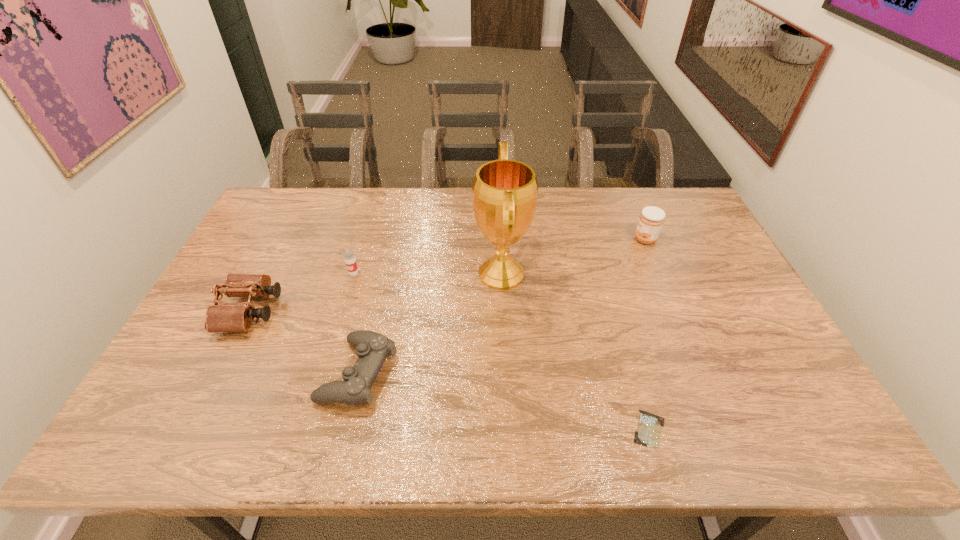
Identify the location of vacant space situated 0.310m on the front-facing side of the fourth object from left to right. This screenshot has width=960, height=540. (372, 274).

You are a GUI agent. You are given a task and a screenshot of the screen. Output one action in this format:
    pyautogui.click(x=<x>, y=<y>)
    Task: Click on the vacant space located 0.140m on the front label of the rightmost object
    This screenshot has height=540, width=960.
    Given the screenshot: What is the action you would take?
    pyautogui.click(x=591, y=239)

This screenshot has width=960, height=540. Find the location of `vacant space situated 0.070m on the front label of the rightmost object`. vacant space situated 0.070m on the front label of the rightmost object is located at coordinates (612, 239).

Where is `vacant region located 0.220m on the front label of the rightmost object`? The width and height of the screenshot is (960, 540). vacant region located 0.220m on the front label of the rightmost object is located at coordinates (567, 239).

I want to click on vacant space situated on the side of the cup with the logo, so click(323, 376).

Locate an element on the screen. Image resolution: width=960 pixels, height=540 pixels. free space located through the eyepieces of the leftmost object is located at coordinates (320, 311).

Identify the location of vacant area situated on the right of the control. This screenshot has width=960, height=540. [529, 373].

You are a GUI agent. You are given a task and a screenshot of the screen. Output one action in this format:
    pyautogui.click(x=<x>, y=<y>)
    Task: Click on the free region located on the left of the shortest object
    Image resolution: width=960 pixels, height=540 pixels.
    Given the screenshot: What is the action you would take?
    pyautogui.click(x=460, y=429)

Image resolution: width=960 pixels, height=540 pixels. I want to click on control at the near edge, so click(372, 348).

In order to click on identity card that is at the near edge in this screenshot , I will do tap(648, 433).